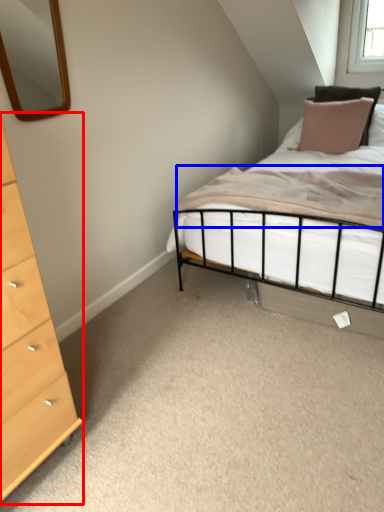
Question: Which object appears farthest to the camera in this image, chest of drawers (highlighted by a red box) or mattress (highlighted by a blue box)?

Choices:
 (A) chest of drawers
 (B) mattress

Answer: (B)